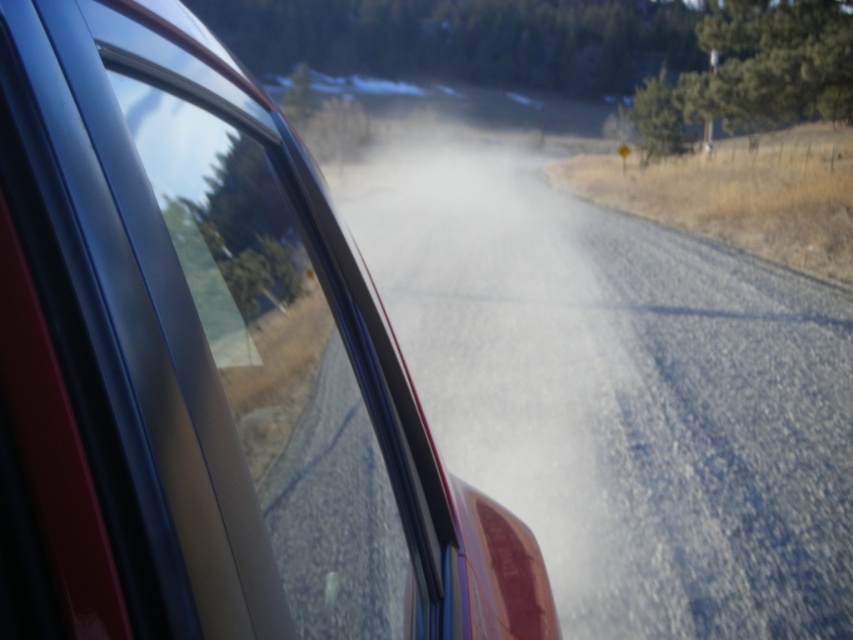
You are a passenger in a car and want to know how far the glossy metallic car at center is from the camera. Can you determine the distance based on the scene?

The glossy metallic car at center is 21.96 inches away from the camera.

You are a passenger in a car and see the glossy metallic car at center and the white powdery dust at center through the window. Which object is closer to the left side of the window?

The white powdery dust at center is closer to the left side of the window because the glossy metallic car at center is positioned on the right side of it.

You are a passenger in a car and notice two objects outside through the window. You see a glossy metallic car at center and a white powdery dust at center. Which object appears larger from your viewpoint?

The white powdery dust at center appears larger than the glossy metallic car at center because the glossy metallic car at center is smaller than white powdery dust at center.